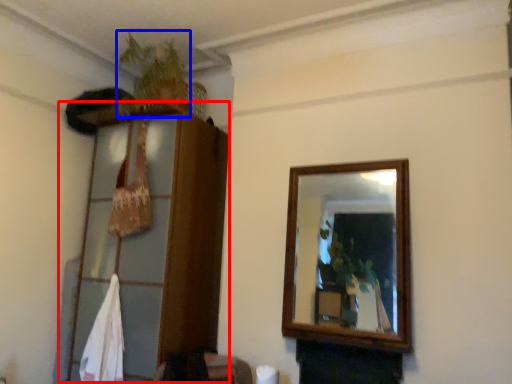
Question: Which point is further to the camera, dresser (highlighted by a red box) or plant (highlighted by a blue box)?

Choices:
 (A) dresser
 (B) plant

Answer: (B)